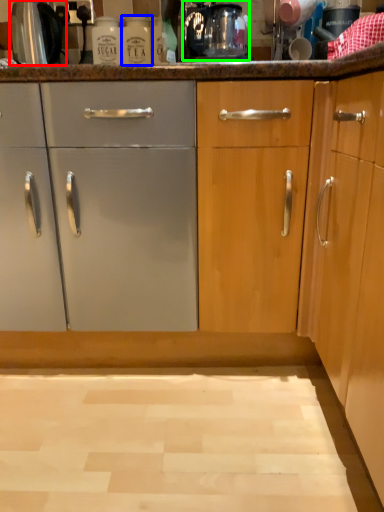
Question: Estimate the real-world distances between objects in this image. Which object is farther from appliance (highlighted by a red box), bottle (highlighted by a blue box) or coffee machine (highlighted by a green box)?

Choices:
 (A) bottle
 (B) coffee machine

Answer: (B)